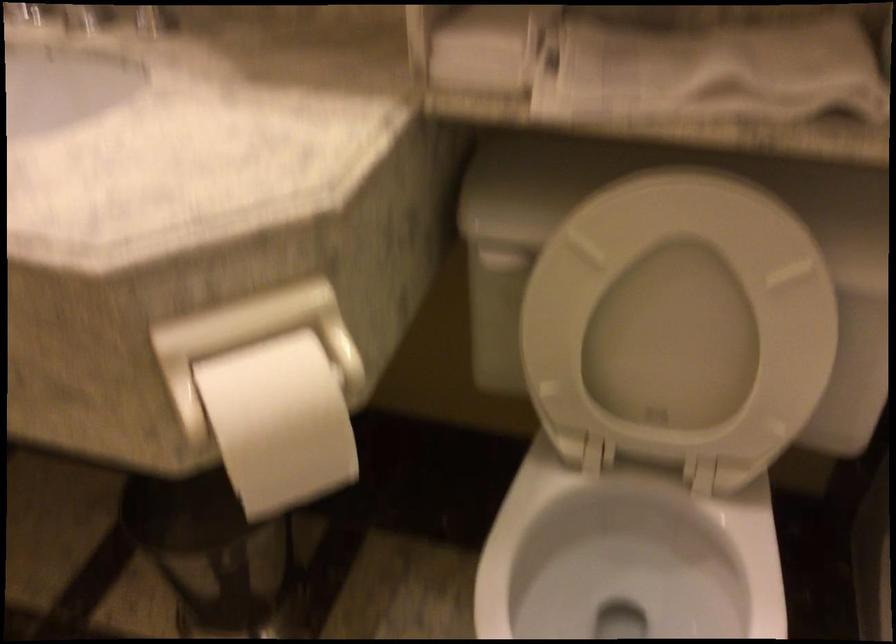
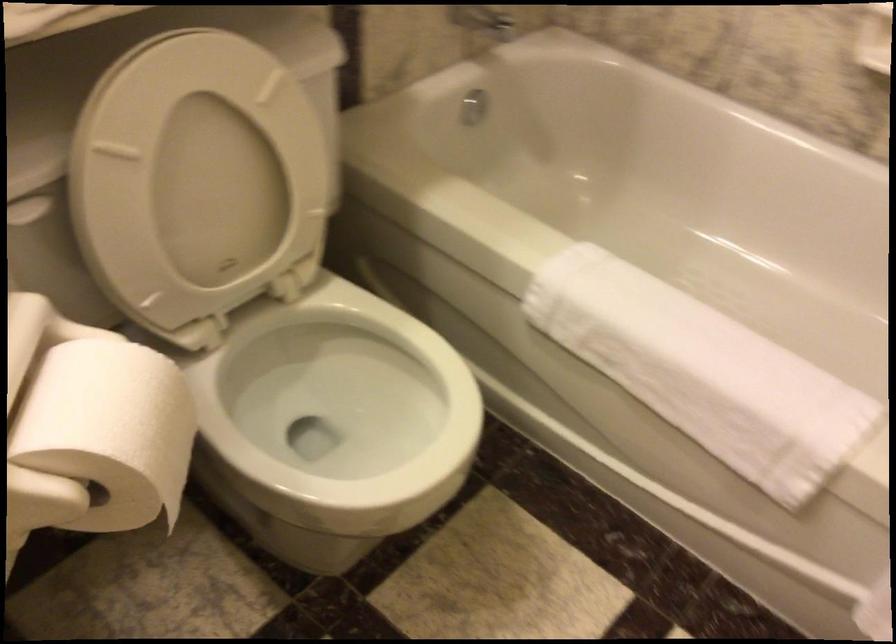
The images are taken continuously from a first-person perspective. In which direction is your viewpoint rotating?

The rotation direction of the camera is right-down.